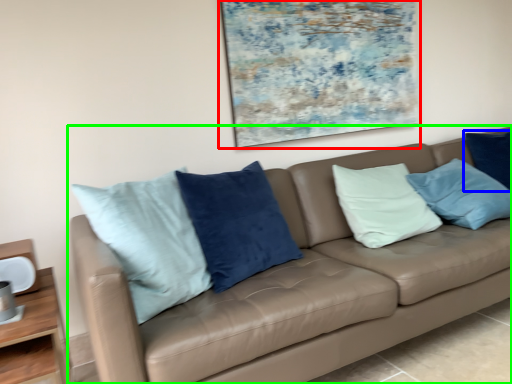
Question: Considering the real-world distances, which object is closest to picture frame (highlighted by a red box)? pillow (highlighted by a blue box) or studio couch (highlighted by a green box).

Choices:
 (A) pillow
 (B) studio couch

Answer: (B)